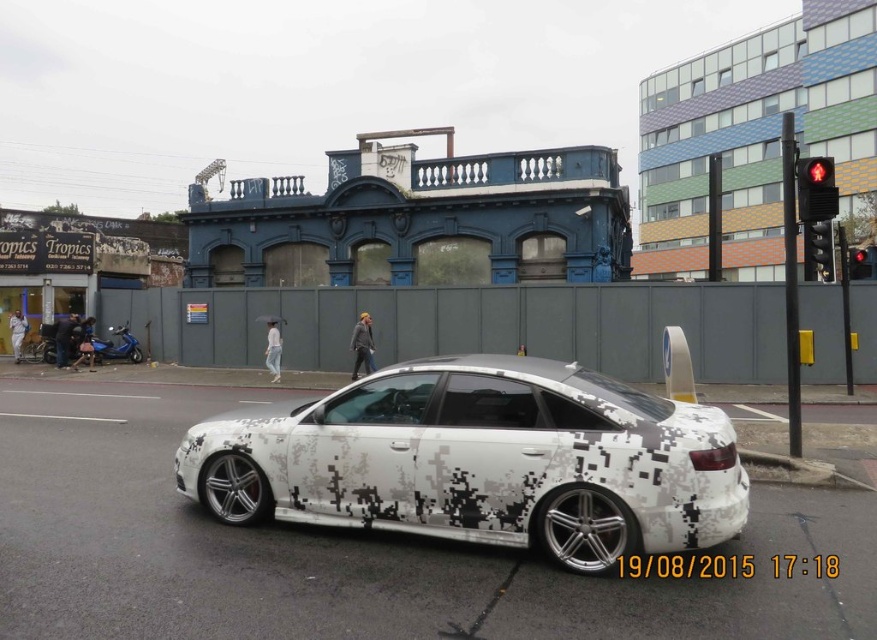
You are standing at the curb marked with a blue circular sign near the camouflage car. You notice two points on the road ahead. The first point is at coordinates point (x=581, y=506) and the second is at point (x=822, y=189). Which point is closer to you?

Point (x=581, y=506) is closer to you because it is in front of point (x=822, y=189).

You are driving a car and need to stop at the metallic black traffic light at right. From your current position, which direction should you turn to face the traffic light?

The metallic black traffic light at right is located at point (818, 252), so you should turn to your right to face it.